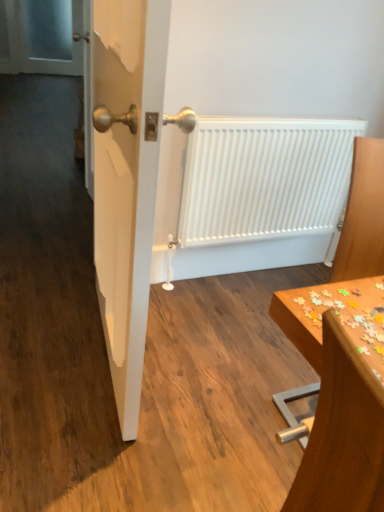
Question: Is wooden table at right inside or outside of white glossy door at center?

Choices:
 (A) outside
 (B) inside

Answer: (A)

Question: Visually, is wooden table at right positioned to the left or to the right of white glossy door at center?

Choices:
 (A) left
 (B) right

Answer: (B)

Question: Estimate the real-world distances between objects in this image. Which object is farther from the wooden table at right?

Choices:
 (A) wooden puzzle pieces at lower right
 (B) white glossy door at center
 (C) transparent glass screen door at upper left
 (D) white matte radiator at center

Answer: (C)

Question: Considering the real-world distances, which object is farthest from the wooden table at right?

Choices:
 (A) wooden puzzle pieces at lower right
 (B) transparent glass screen door at upper left
 (C) white glossy door at center
 (D) white matte radiator at center

Answer: (B)